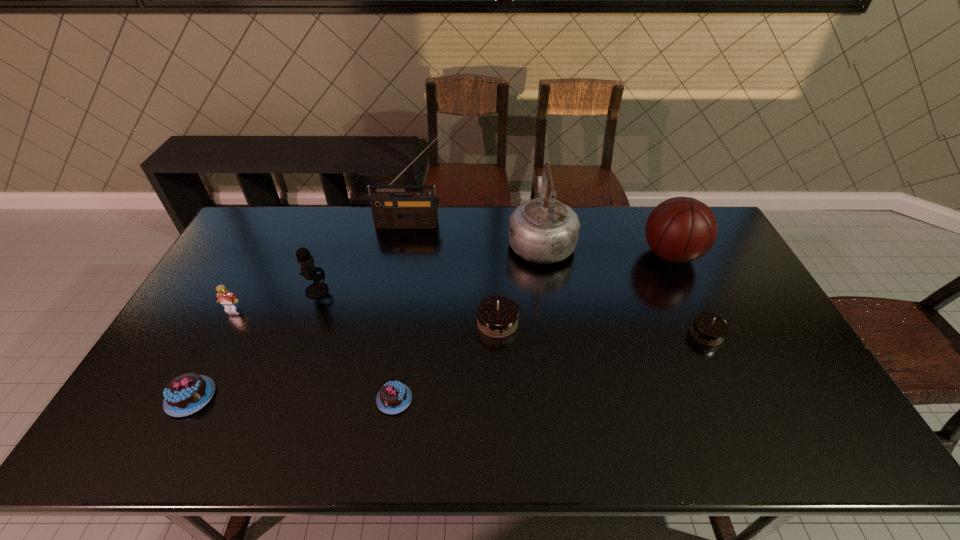
Locate an element on the screen. This screenshot has height=540, width=960. free space located on the front of the smaller chocolate chocolate cake is located at coordinates (744, 416).

Where is `vacant space positioned 0.070m on the back of the bigger pink chocolate cake`? This screenshot has width=960, height=540. vacant space positioned 0.070m on the back of the bigger pink chocolate cake is located at coordinates (213, 355).

Locate an element on the screen. The width and height of the screenshot is (960, 540). vacant space located on the right of the second chocolate cake from left to right is located at coordinates (464, 399).

Find the location of a particular element. Image resolution: width=960 pixels, height=540 pixels. radio receiver at the far edge is located at coordinates (417, 209).

Image resolution: width=960 pixels, height=540 pixels. I want to click on kettle situated at the far edge, so click(x=545, y=231).

Identify the location of basketball that is at the far edge. (681, 229).

Locate an element on the screen. Image resolution: width=960 pixels, height=540 pixels. Lego that is at the left edge is located at coordinates (228, 300).

Where is `chocolate cake located in the left edge section of the desktop`? chocolate cake located in the left edge section of the desktop is located at coordinates (187, 393).

Where is `object that is at the right edge`? The height and width of the screenshot is (540, 960). object that is at the right edge is located at coordinates (681, 229).

Where is `object positioned at the far right corner`? Image resolution: width=960 pixels, height=540 pixels. object positioned at the far right corner is located at coordinates (681, 229).